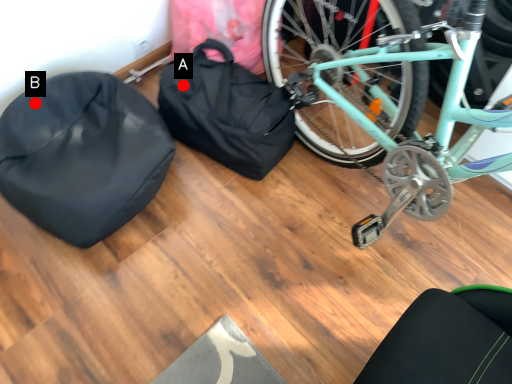
Question: Two points are circled on the image, labeled by A and B beside each circle. Which point is farther from the camera taking this photo?

Choices:
 (A) A is further
 (B) B is further

Answer: (A)